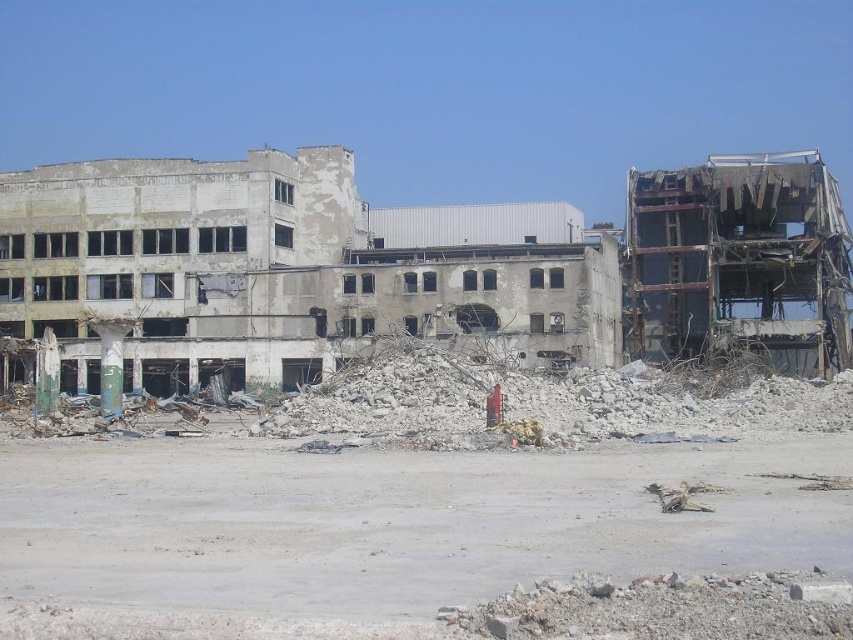
Image resolution: width=853 pixels, height=640 pixels. Find the location of `gray rubble at center`. gray rubble at center is located at coordinates (442, 516).

Is gray rubble at center below gray concrete rubble at center?

Yes, gray rubble at center is below gray concrete rubble at center.

Between point (815, 541) and point (781, 308), which one is positioned behind?

The point (781, 308) is behind.

This screenshot has height=640, width=853. I want to click on gray rubble at center, so click(x=442, y=516).